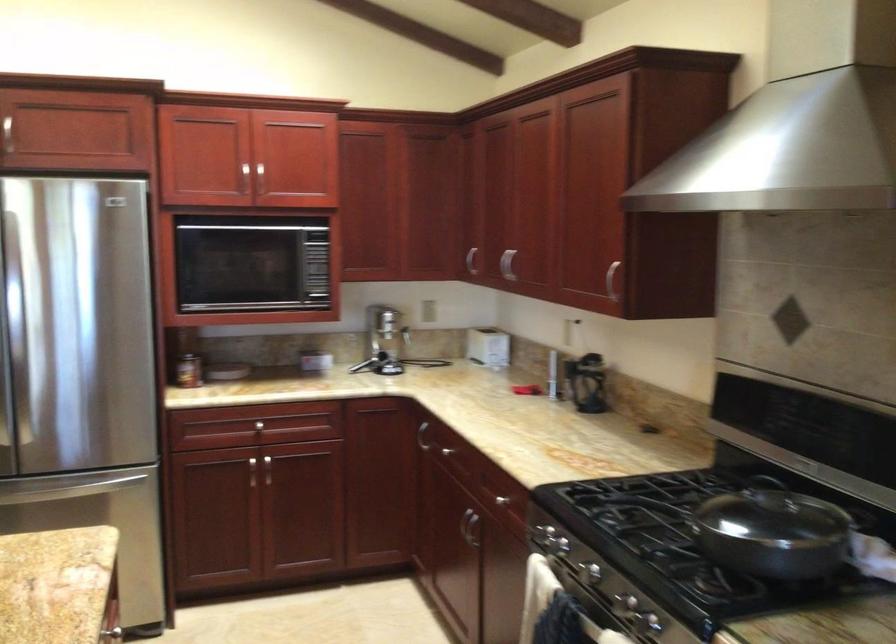
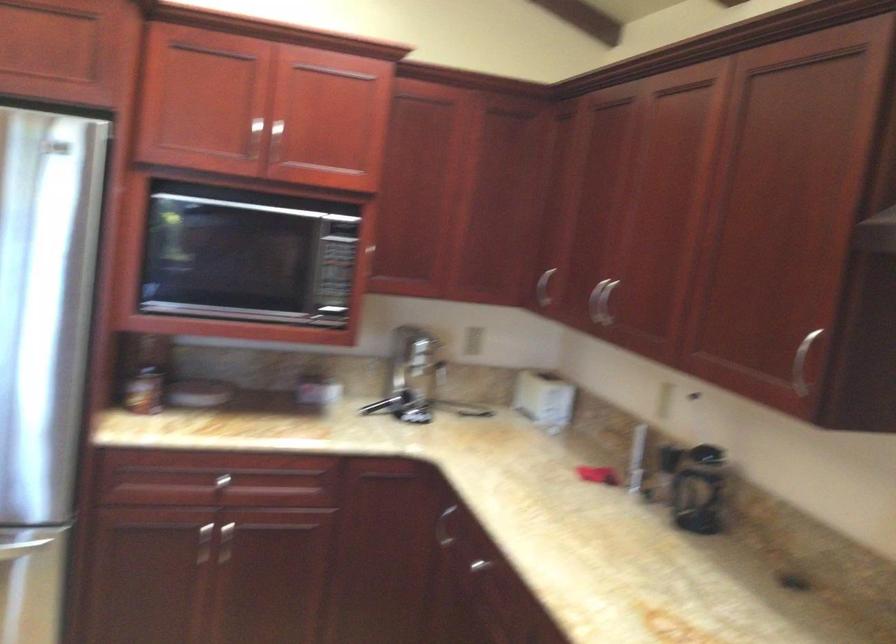
In the second image, find the point that corresponds to (259,178) in the first image.

(274, 140)